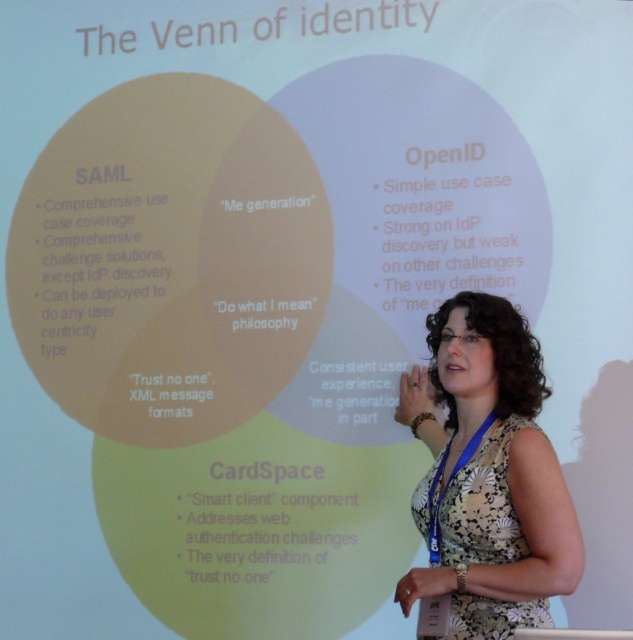
Can you confirm if floral dress at center is positioned above floral print fabric dress at lower right?

Yes, floral dress at center is above floral print fabric dress at lower right.

Who is taller, floral dress at center or floral print fabric dress at lower right?

Standing taller between the two is floral dress at center.

The width and height of the screenshot is (633, 640). In order to click on floral dress at center in this screenshot , I will do `click(491, 477)`.